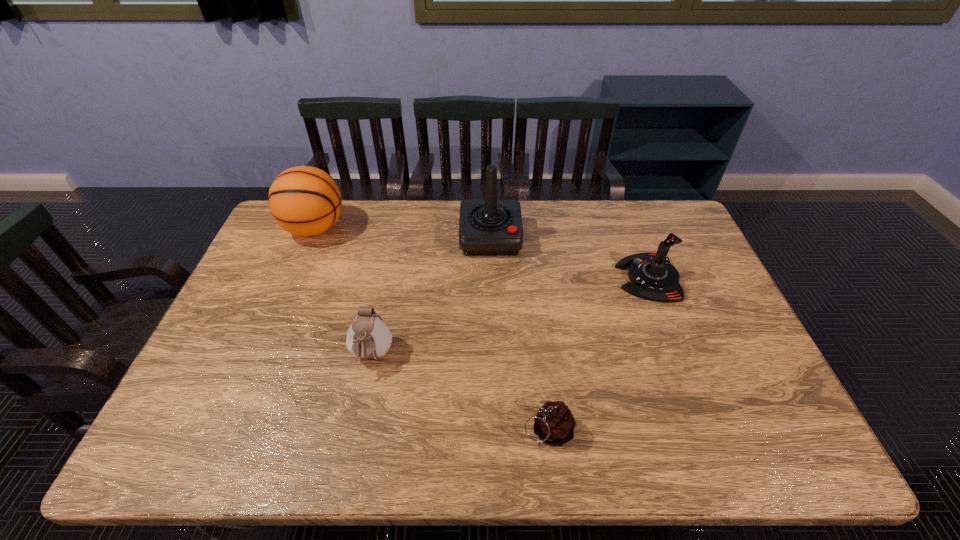
Where is `free space located on the front-facing side of the taller joystick`? The width and height of the screenshot is (960, 540). free space located on the front-facing side of the taller joystick is located at coordinates (492, 343).

Where is `vacant area located 0.190m on the right of the leftmost object`? vacant area located 0.190m on the right of the leftmost object is located at coordinates (401, 228).

The image size is (960, 540). In order to click on vacant space located 0.160m on the handle side of the right joystick in this screenshot , I will do `click(566, 278)`.

The image size is (960, 540). Find the location of `free region located 0.090m on the handle side of the right joystick`. free region located 0.090m on the handle side of the right joystick is located at coordinates (588, 278).

Locate an element on the screen. The width and height of the screenshot is (960, 540). vacant area located 0.300m on the handle side of the right joystick is located at coordinates (521, 278).

At what (x,y) coordinates should I click in order to perform the action: click on free space located on the front-facing side of the pouch. Please return your answer as a coordinate pair (x, y). This screenshot has width=960, height=540. Looking at the image, I should click on (363, 400).

You are a GUI agent. You are given a task and a screenshot of the screen. Output one action in this format:
    pyautogui.click(x=<x>, y=<y>)
    Task: Click on the vacant area situated with a leaf charm attached to the shortest object
    The image size is (960, 540).
    Given the screenshot: What is the action you would take?
    pyautogui.click(x=420, y=430)

Locate an element on the screen. vacant space situated 0.380m with a leaf charm attached to the shortest object is located at coordinates (359, 430).

Find the location of a particular element. free space located with a leaf charm attached to the shortest object is located at coordinates (406, 430).

You are a GUI agent. You are given a task and a screenshot of the screen. Output one action in this format:
    pyautogui.click(x=<x>, y=<y>)
    Task: Click on the joystick positioned at the far edge
    Image resolution: width=960 pixels, height=540 pixels.
    Given the screenshot: What is the action you would take?
    pyautogui.click(x=490, y=227)